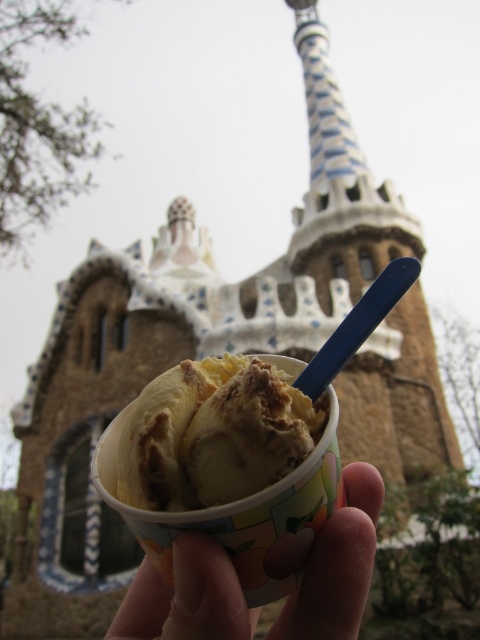
Between vanilla ice cream at center and smooth skin hand at center, which one is positioned higher?

vanilla ice cream at center

Who is more forward, (x=244, y=388) or (x=162, y=605)?

Point (x=244, y=388)

What do you see at coordinates (214, 435) in the screenshot? I see `vanilla ice cream at center` at bounding box center [214, 435].

This screenshot has width=480, height=640. I want to click on vanilla ice cream at center, so click(214, 435).